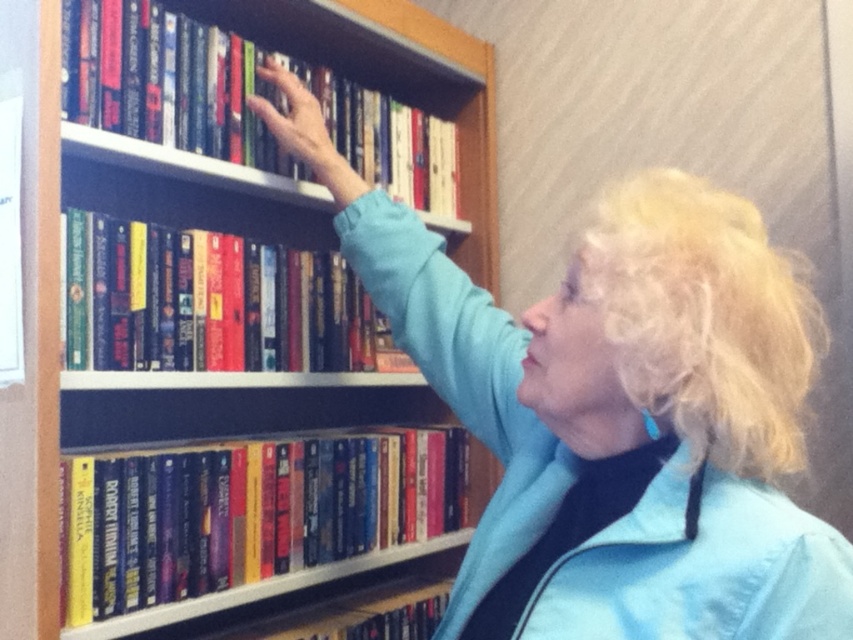
Which is more to the right, wooden bookshelf at upper center or hardcover book at upper center?

Positioned to the right is wooden bookshelf at upper center.

Which is below, wooden bookshelf at upper center or hardcover book at upper center?

Positioned lower is hardcover book at upper center.

Which is behind, point (219, 396) or point (109, 321)?

The point (219, 396) is more distant.

The image size is (853, 640). I want to click on wooden bookshelf at upper center, so click(57, 330).

Between blue denim jacket at upper right and hardcover book at center, which one is positioned lower?

Positioned lower is hardcover book at center.

Does blue denim jacket at upper right have a greater width compared to hardcover book at center?

Correct, the width of blue denim jacket at upper right exceeds that of hardcover book at center.

What do you see at coordinates (614, 412) in the screenshot? I see `blue denim jacket at upper right` at bounding box center [614, 412].

Locate an element on the screen. The image size is (853, 640). blue denim jacket at upper right is located at coordinates click(614, 412).

Which is above, blue denim jacket at upper right or hardcover book at upper left?

hardcover book at upper left

The height and width of the screenshot is (640, 853). What do you see at coordinates (614, 412) in the screenshot? I see `blue denim jacket at upper right` at bounding box center [614, 412].

Is point (567, 278) positioned before point (184, 26)?

Yes.

At what (x,y) coordinates should I click in order to perform the action: click on blue denim jacket at upper right. Please return your answer as a coordinate pair (x, y). This screenshot has height=640, width=853. Looking at the image, I should click on (614, 412).